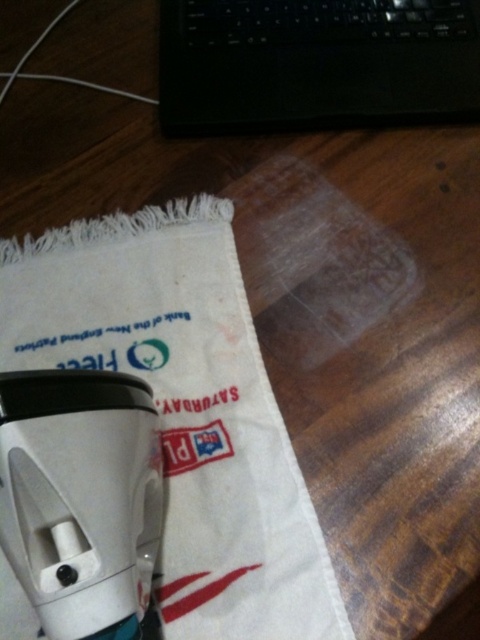
Question: From the image, what is the correct spatial relationship of white cotton bag at center in relation to black plastic laptop at upper center?

Choices:
 (A) below
 (B) above

Answer: (A)

Question: Does white cotton bag at center appear under black plastic laptop at upper center?

Choices:
 (A) no
 (B) yes

Answer: (B)

Question: Which of the following is the farthest from the observer?

Choices:
 (A) white cotton bag at center
 (B) black plastic laptop at upper center

Answer: (B)

Question: Does white cotton bag at center lie behind black plastic laptop at upper center?

Choices:
 (A) no
 (B) yes

Answer: (A)